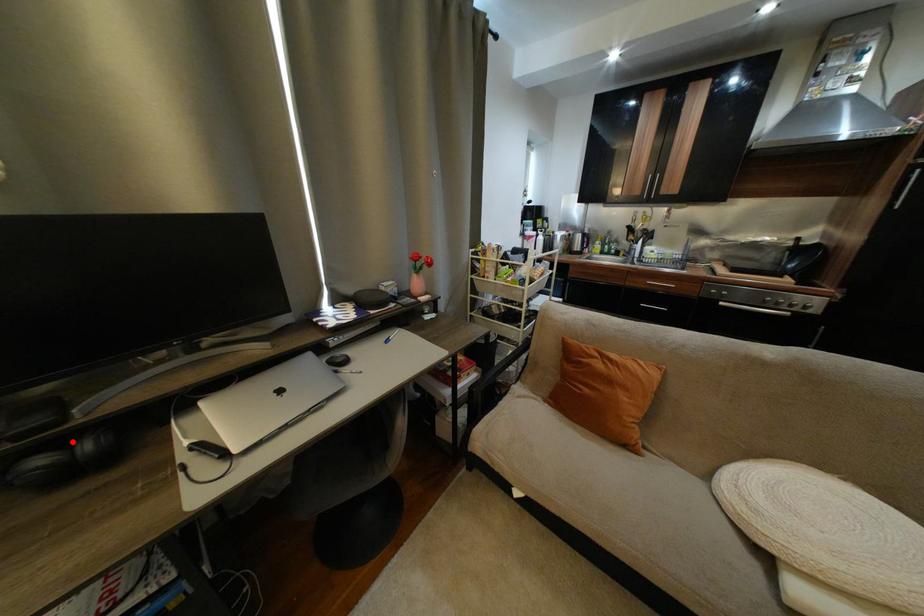
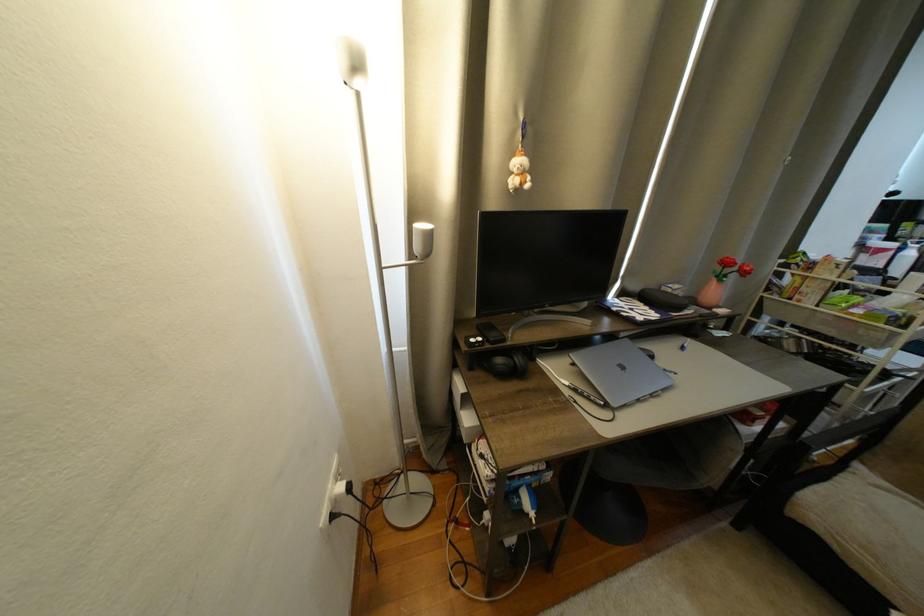
Where in the second image is the point corresponding to the highlighted location from the first image?

(517, 354)